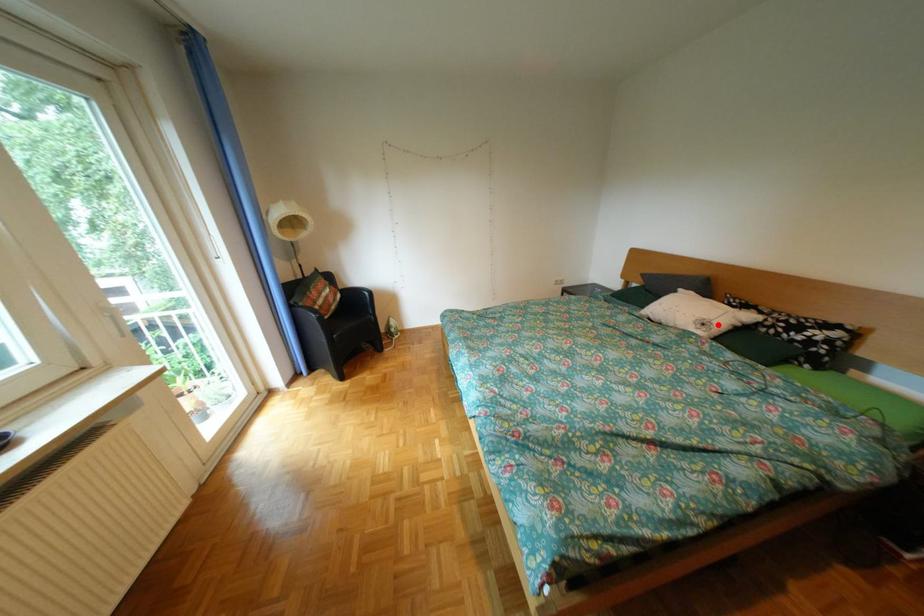
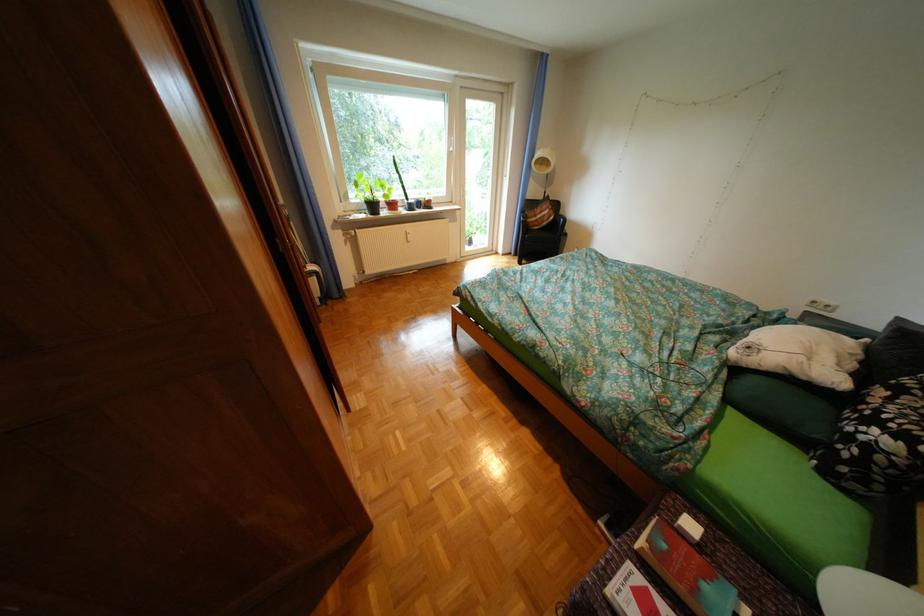
In the second image, find the point that corresponds to the highlighted location in the first image.

(763, 349)